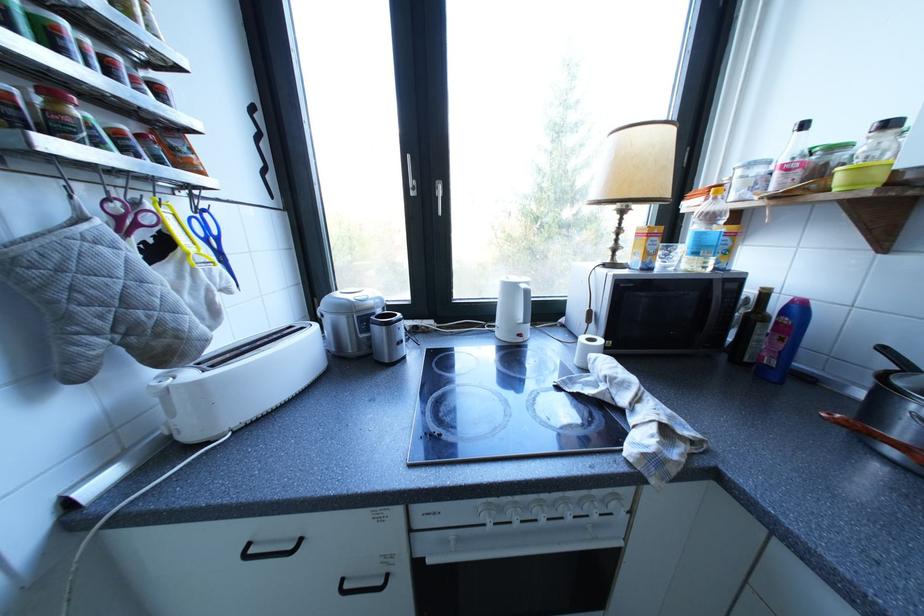
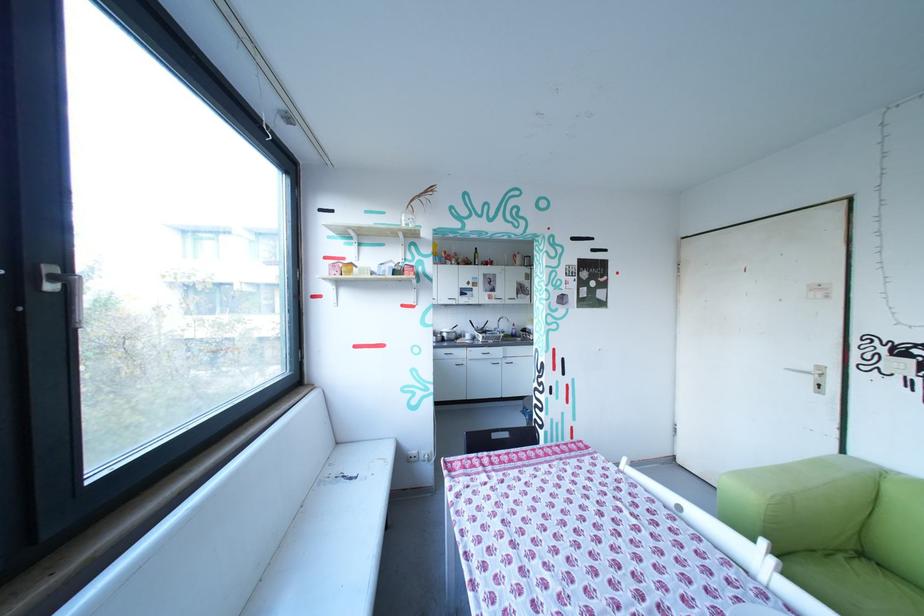
Question: I am providing you with two images of the same scene from different viewpoints. Please identify which objects are invisible in image2.

Choices:
 (A) clear glass vase
 (B) blue shaker handle
 (C) silver door handle
 (D) microwave door handle

Answer: (D)